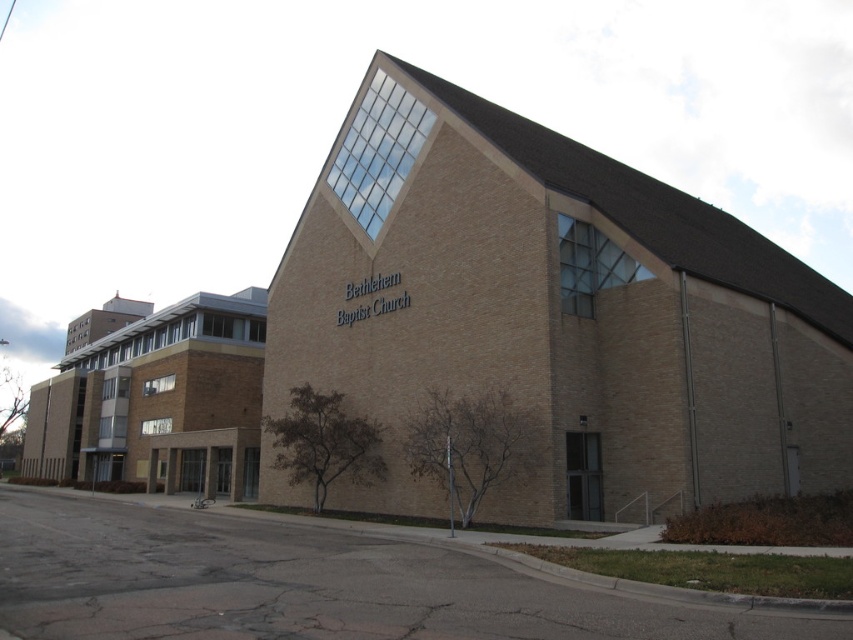
Between brown brick church at center and brown brick building at left, which one is positioned lower?

brown brick building at left

Can you confirm if brown brick church at center is bigger than brown brick building at left?

No.

Does point (573, 161) lie behind point (97, 380)?

No, (573, 161) is in front of (97, 380).

Identify the location of brown brick church at center. (554, 314).